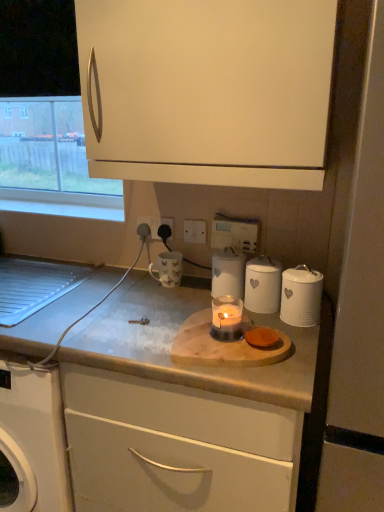
Find the location of `vacant position to the left of translucent glass candle at center`. vacant position to the left of translucent glass candle at center is located at coordinates (142, 336).